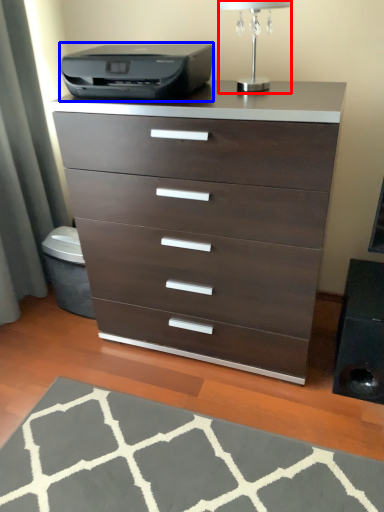
Question: Which point is closer to the camera, table lamp (highlighted by a red box) or printer (highlighted by a blue box)?

Choices:
 (A) table lamp
 (B) printer

Answer: (A)